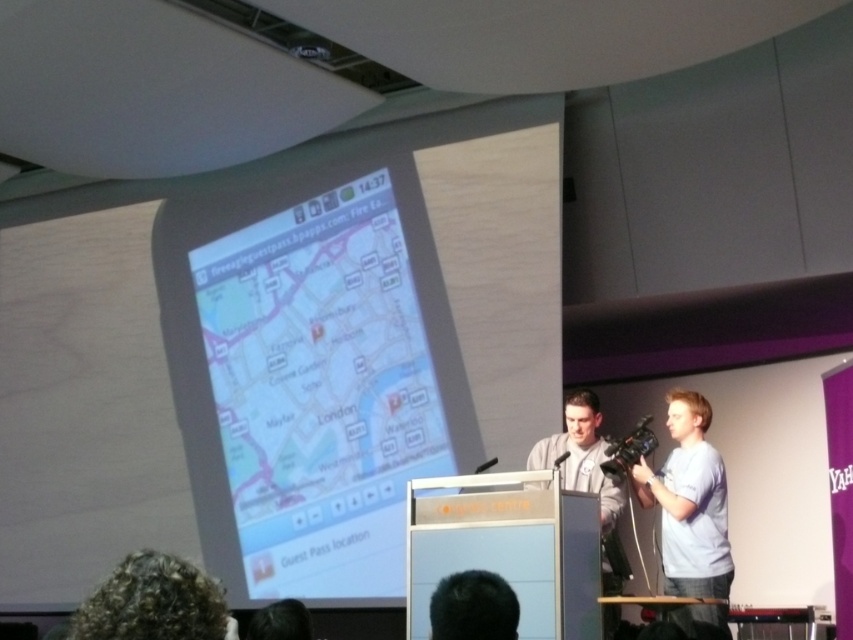
Is point (328, 515) positioned before point (286, 618)?

No, it is not.

Consider the image. Who is lower down, transparent plastic map at center or dark brown hair at lower center?

dark brown hair at lower center is lower down.

The width and height of the screenshot is (853, 640). Find the location of `transparent plastic map at center`. transparent plastic map at center is located at coordinates (322, 387).

Find the location of a particular element. The width and height of the screenshot is (853, 640). transparent plastic map at center is located at coordinates (322, 387).

Does light blue cotton shirt at right appear on the left side of dark brown hair at lower center?

No, light blue cotton shirt at right is not to the left of dark brown hair at lower center.

Who is higher up, light blue cotton shirt at right or dark brown hair at lower center?

Positioned higher is light blue cotton shirt at right.

Locate an element on the screen. This screenshot has height=640, width=853. light blue cotton shirt at right is located at coordinates (689, 502).

Between point (670, 538) and point (108, 612), which one is positioned in front?

Point (108, 612)

Between light blue cotton shirt at right and curly hair at lower left, which one is positioned lower?

light blue cotton shirt at right is below.

At what (x,y) coordinates should I click in order to perform the action: click on light blue cotton shirt at right. Please return your answer as a coordinate pair (x, y). The width and height of the screenshot is (853, 640). Looking at the image, I should click on (689, 502).